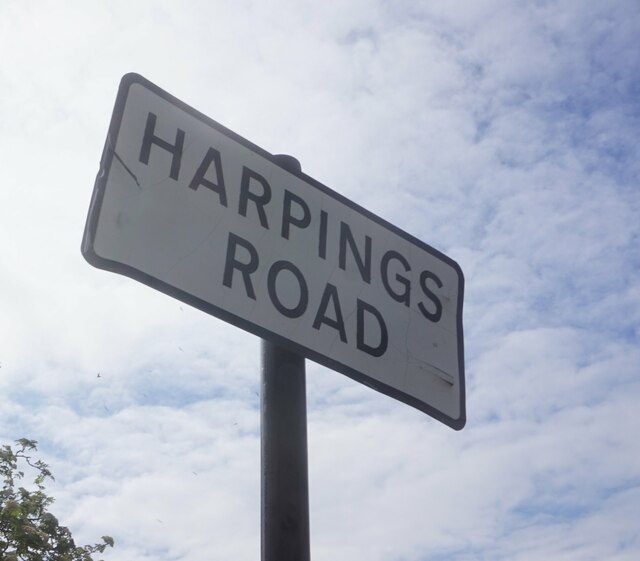
Find the location of a particular element. The width and height of the screenshot is (640, 561). the top left corner empty space is located at coordinates (10, 11).